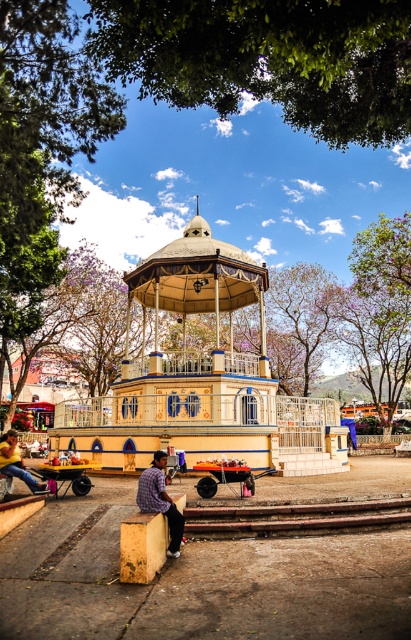
You are standing at point (378, 72) and want to walk to the bandstand. The bandstand is 12.03 meters away. If you can walk at a speed of 1.5 meters per second, how many seconds will it take you to reach the bandstand?

The distance to the bandstand is 12.03 meters, and walking at 1.5 meters per second, it will take 12.03 divided by 1.9 equals approximately 6.33 seconds. So the answer is about 6.33 seconds.

You are a photographer trying to capture a clear shot of the bandstand. You notice the green leafy canopy at upper center and the denim pants at lower left. Which object is closer to your camera lens?

The green leafy canopy at upper center is closer to the camera lens because it is in front of the denim pants at lower left.

You are standing at the center of the bandstand and want to place a new decorative flagpole. The flagpole needs to be placed exactly 0.1 units to the left of the rusty metal train track at lower center. What are the coordinates where you should place the flagpole?

The coordinates for the flagpole should be calculated by subtracting 0.1 from the x coordinate of the rusty metal train track at lower center. The original coordinates are at point (295, 516). Subtracting 0.1 from the x coordinate gives 0.709. Therefore, the flagpole should be placed at coordinates (295, 452).